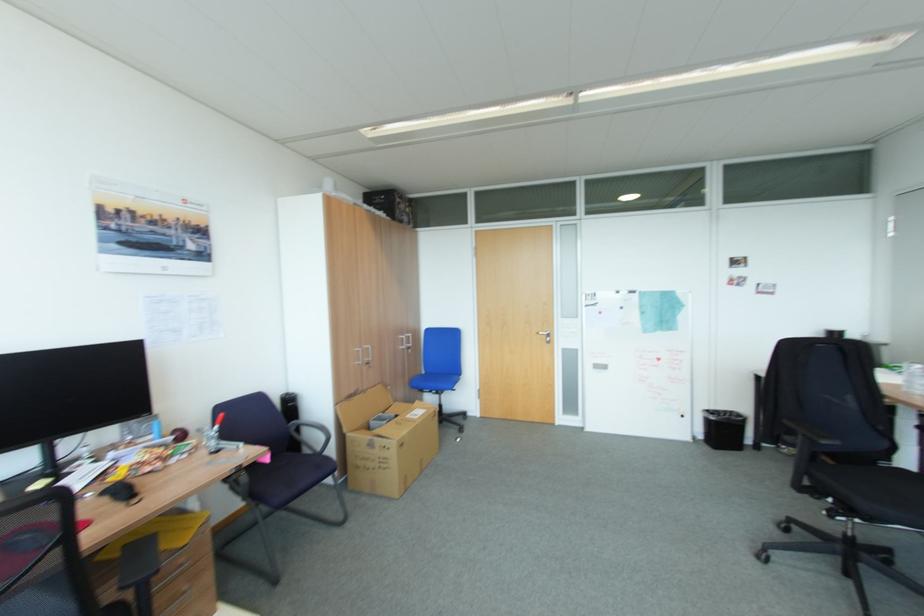
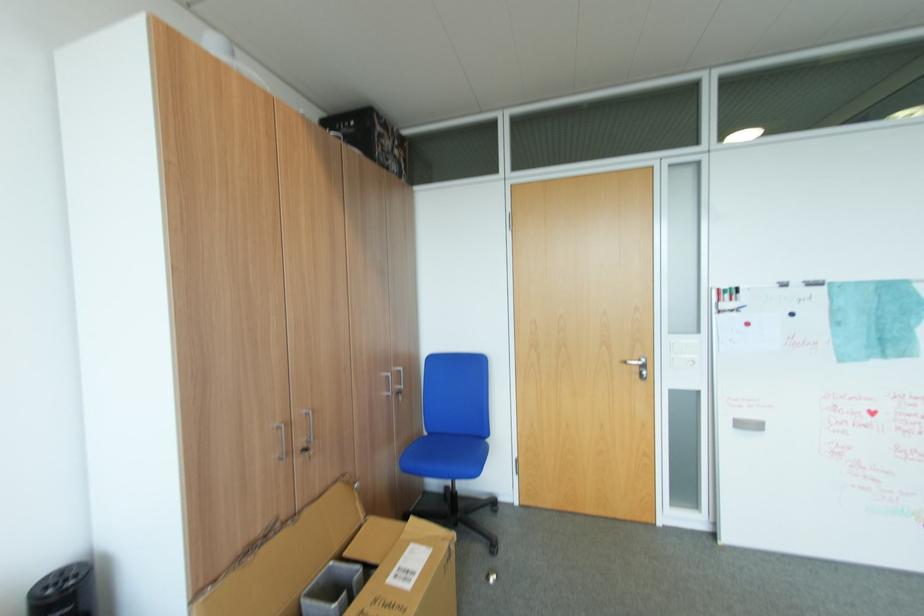
Find the pixel in the second image that matches point 373,363 in the first image.

(310, 451)